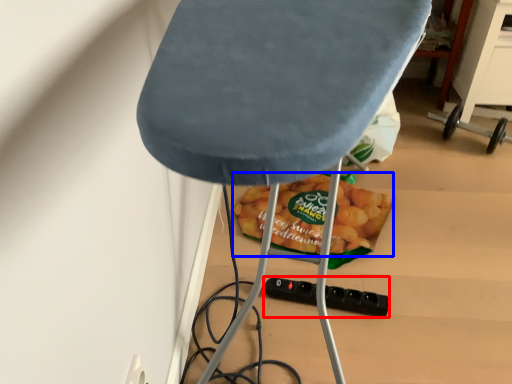
Question: Which object appears farthest to the camera in this image, socket (highlighted by a red box) or snack (highlighted by a blue box)?

Choices:
 (A) socket
 (B) snack

Answer: (B)